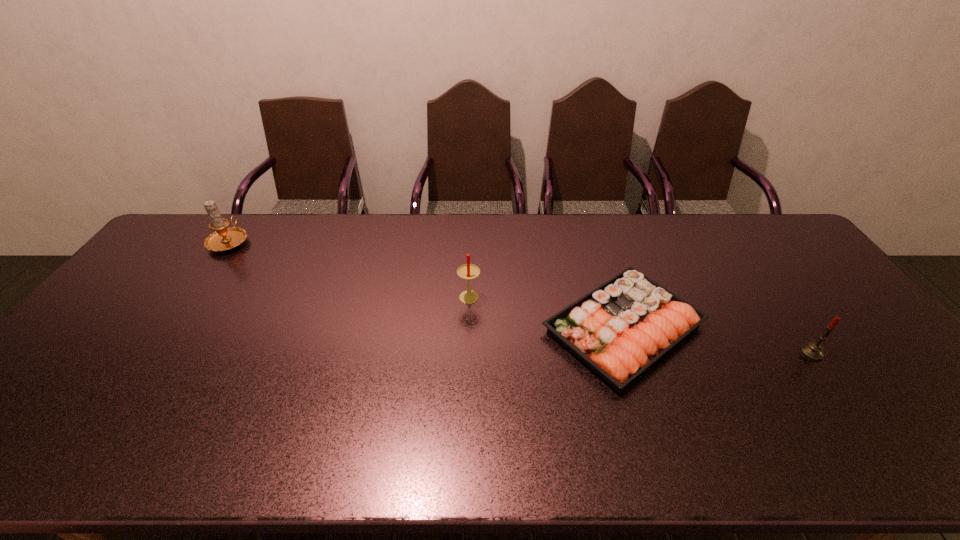
Find the location of a particular element. empty location between the shortest object and the second shortest object is located at coordinates (718, 340).

I want to click on free space between the second nearest candle and the second object from right to left, so click(546, 312).

Locate an element on the screen. blank region between the second object from right to left and the second object from left to right is located at coordinates (546, 312).

Locate an element on the screen. The image size is (960, 540). vacant space that is in between the farthest object and the third object from right to left is located at coordinates pyautogui.click(x=349, y=268).

This screenshot has height=540, width=960. Find the location of `vacant area that lies between the nearest candle and the second object from right to left`. vacant area that lies between the nearest candle and the second object from right to left is located at coordinates (718, 340).

This screenshot has width=960, height=540. Find the location of `vacant area that lies between the farthest candle and the shortest candle`. vacant area that lies between the farthest candle and the shortest candle is located at coordinates (520, 297).

You are a GUI agent. You are given a task and a screenshot of the screen. Output one action in this format:
    pyautogui.click(x=<x>, y=<y>)
    Task: Click on the unoccupied area between the rightmost candle and the farthest object
    This screenshot has height=540, width=960.
    Given the screenshot: What is the action you would take?
    pyautogui.click(x=520, y=297)

Image resolution: width=960 pixels, height=540 pixels. I want to click on object that is the second closest to the third object from right to left, so click(x=223, y=239).

I want to click on the third closest object to the second shortest object, so click(x=223, y=239).

Locate an element on the screen. The width and height of the screenshot is (960, 540). the closest candle to the shortest candle is located at coordinates (468, 271).